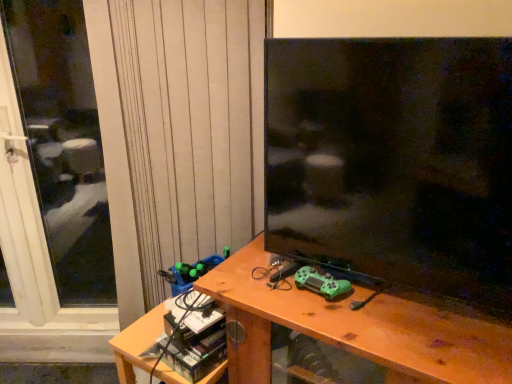
Question: Considering their positions, is wooden desk at center located in front of or behind transparent glass screen door at left?

Choices:
 (A) front
 (B) behind

Answer: (A)

Question: Does point (486, 329) appear closer or farther from the camera than point (87, 84)?

Choices:
 (A) farther
 (B) closer

Answer: (B)

Question: Considering the real-world distances, which object is farthest from the transparent glass screen door at left?

Choices:
 (A) green plastic toy at lower left, the second toy viewed from the right
 (B) matte black tv at center
 (C) wooden desk at center
 (D) green matte game controller at center, the second toy in the left-to-right sequence
 (E) white textured curtain at upper left

Answer: (D)

Question: Estimate the real-world distances between objects in this image. Which object is closer to the green matte game controller at center, positioned as the 2th toy in back-to-front order?

Choices:
 (A) wooden desk at center
 (B) matte black tv at center
 (C) green plastic toy at lower left, the second toy viewed from the right
 (D) white textured curtain at upper left
 (E) transparent glass screen door at left

Answer: (A)